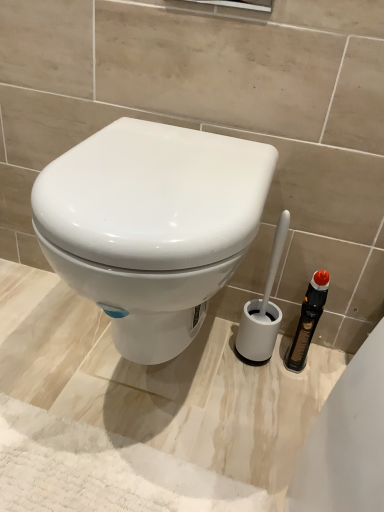
The image size is (384, 512). I want to click on vacant space underneath white glossy toilet at center (from a real-world perspective), so click(x=130, y=391).